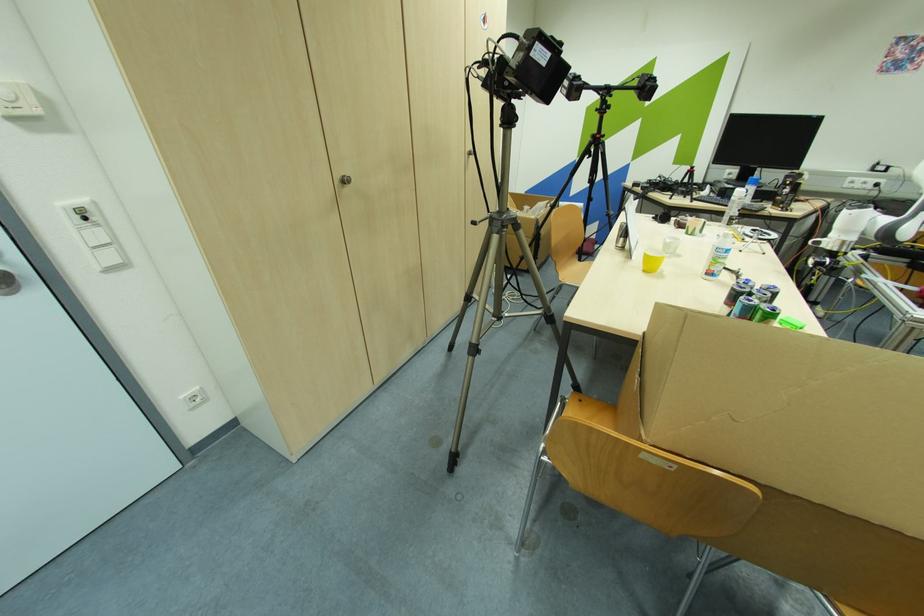
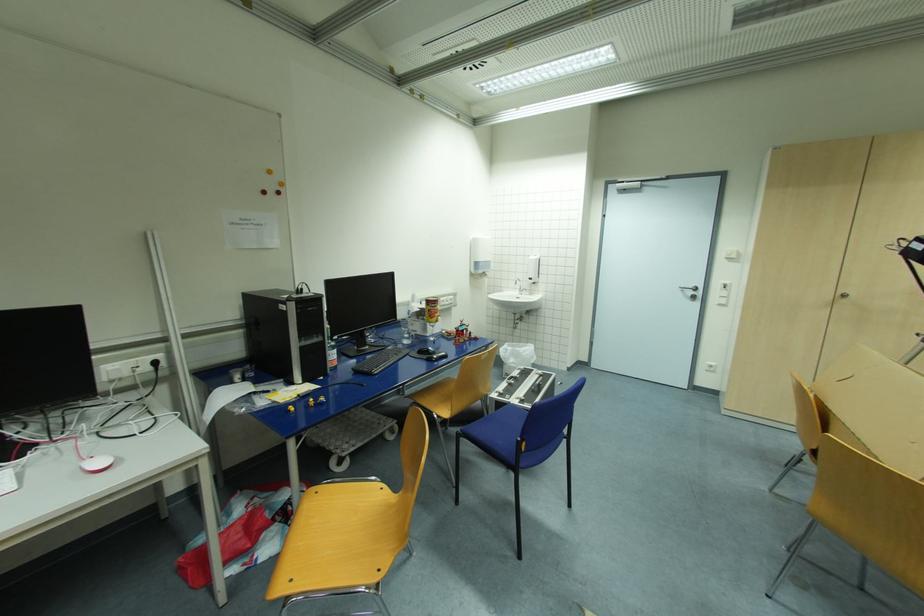
Find the pixel in the second image that matches pixel 348 182 in the first image.

(847, 296)